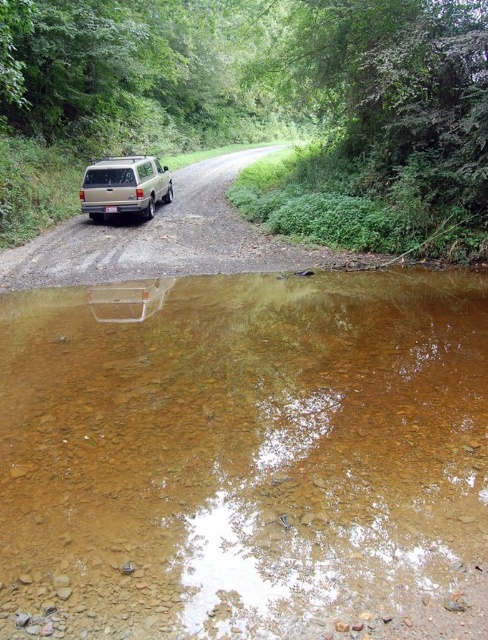
You are standing at the point labeled point (348, 509) and want to walk to the point labeled point (138, 196). Based on the image, which direction should you face to walk directly towards your destination?

Since point (348, 509) is closer to the camera than point (138, 196), you should face away from the camera to walk directly towards your destination.

You are driving a car that is 2 meters wide. You come across the brown rocky stream at center and the silver metallic suv at left in the scene. Which one has a narrower width?

The brown rocky stream at center has a lesser width compared to the silver metallic suv at left, so the brown rocky stream at center is narrower.